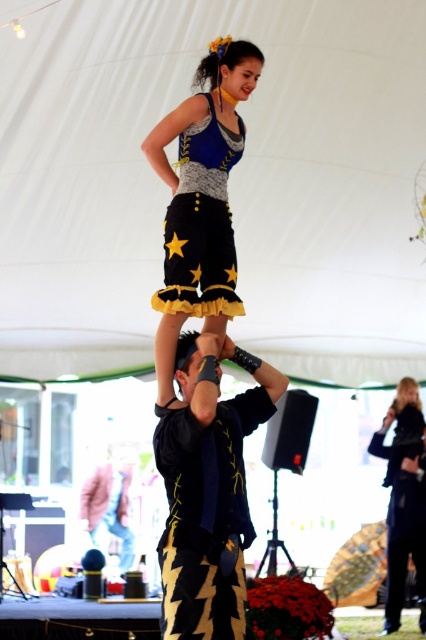
Question: Which point is farther to the camera?

Choices:
 (A) (244, 68)
 (B) (80, 508)
 (C) (417, 573)

Answer: (B)

Question: Does black textured shirt at center have a lesser width compared to blue denim dress at center?

Choices:
 (A) no
 (B) yes

Answer: (A)

Question: Estimate the real-world distances between objects in this image. Which object is closer to the black textured shirt at center?

Choices:
 (A) blue denim dress at center
 (B) shiny blue fabric dress at center
 (C) matte black jacket at center
 (D) pink fabric jacket at center

Answer: (B)

Question: Which of the following is the closest to the observer?

Choices:
 (A) black textured shirt at center
 (B) pink fabric jacket at center
 (C) shiny blue fabric dress at center

Answer: (A)

Question: Does shiny blue fabric dress at center appear on the right side of blue denim dress at center?

Choices:
 (A) no
 (B) yes

Answer: (A)

Question: Does black textured shirt at center have a greater width compared to blue denim dress at center?

Choices:
 (A) no
 (B) yes

Answer: (B)